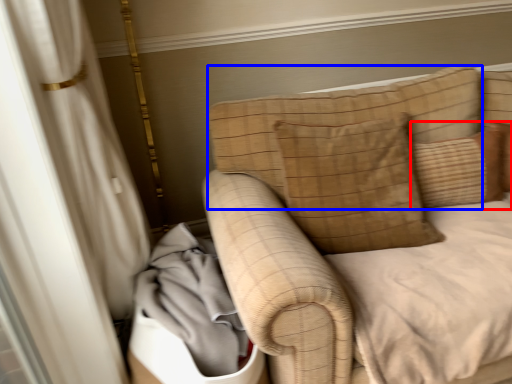
Question: Among these objects, which one is farthest to the camera, pillow (highlighted by a red box) or pillow (highlighted by a blue box)?

Choices:
 (A) pillow
 (B) pillow

Answer: (A)